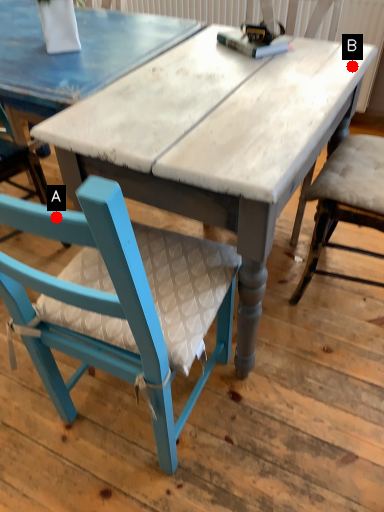
Question: Two points are circled on the image, labeled by A and B beside each circle. Among these points, which one is farthest from the camera?

Choices:
 (A) A is further
 (B) B is further

Answer: (B)